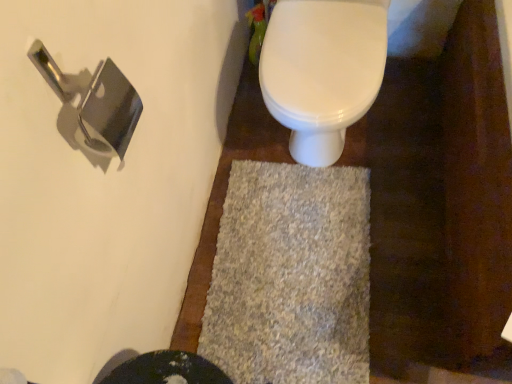
Locate an element on the screen. The width and height of the screenshot is (512, 384). free spot to the right of white glossy toilet at upper center is located at coordinates (410, 111).